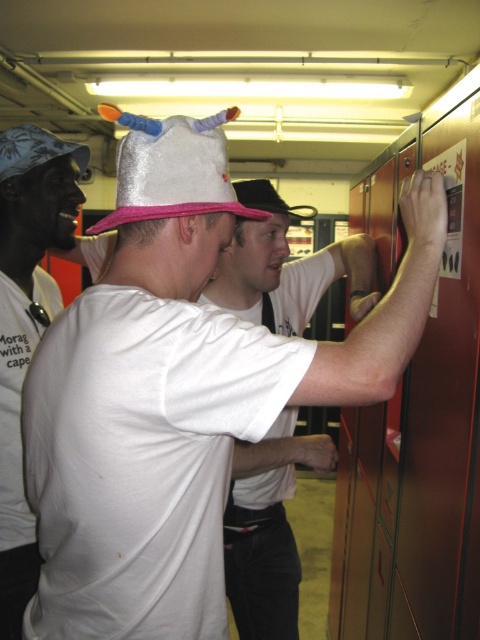
Question: Among these points, which one is farthest from the camera?

Choices:
 (A) (248, 392)
 (B) (296, 333)

Answer: (B)

Question: Which of the following is the farthest from the observer?

Choices:
 (A) (122, 205)
 (B) (120, 406)

Answer: (A)

Question: Is blue fabric cap at upper left bigger than white cotton t-shirt at center?

Choices:
 (A) yes
 (B) no

Answer: (B)

Question: Is white matte hat at center thinner than blue fabric cap at upper left?

Choices:
 (A) yes
 (B) no

Answer: (B)

Question: Does blue fabric cap at upper left have a greater width compared to white cotton t-shirt at center?

Choices:
 (A) no
 (B) yes

Answer: (A)

Question: Which object appears closest to the camera in this image?

Choices:
 (A) blue fabric cap at upper left
 (B) shiny metallic hat at upper left
 (C) silver glittery hat at center

Answer: (C)